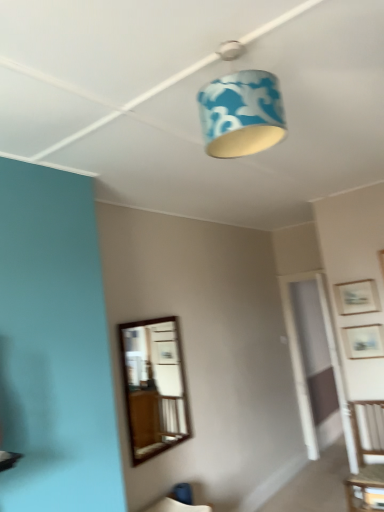
Question: From the image's perspective, is wooden table at lower right above or below wooden picture frame at upper right, placed as the second picture frame when sorted from bottom to top?

Choices:
 (A) above
 (B) below

Answer: (B)

Question: Is point (362, 482) closer or farther from the camera than point (347, 288)?

Choices:
 (A) closer
 (B) farther

Answer: (A)

Question: Which of these objects is positioned farthest from the wooden-framed mirror at center?

Choices:
 (A) wooden picture frame at upper right, placed as the second picture frame when sorted from top to bottom
 (B) wooden picture frame at upper right, placed as the second picture frame when sorted from bottom to top
 (C) wooden chair at right
 (D) blue fabric lampshade at upper center
 (E) wooden table at lower right

Answer: (D)

Question: Estimate the real-world distances between objects in this image. Which object is closer to the wooden table at lower right?

Choices:
 (A) blue fabric lampshade at upper center
 (B) wooden picture frame at upper right, which appears as the 1th picture frame when ordered from the bottom
 (C) wooden chair at right
 (D) wooden-framed mirror at center
 (E) wooden picture frame at upper right, placed as the second picture frame when sorted from bottom to top

Answer: (C)